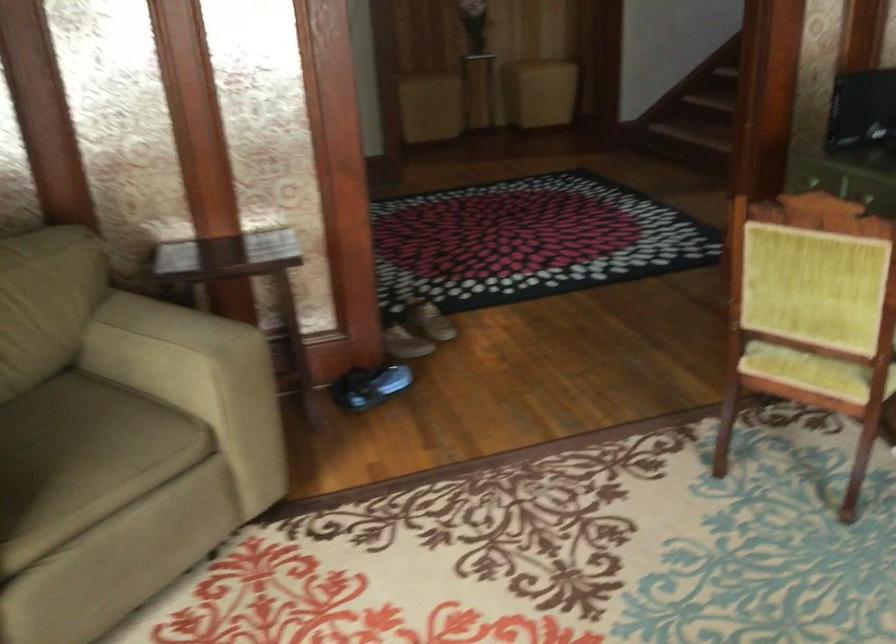
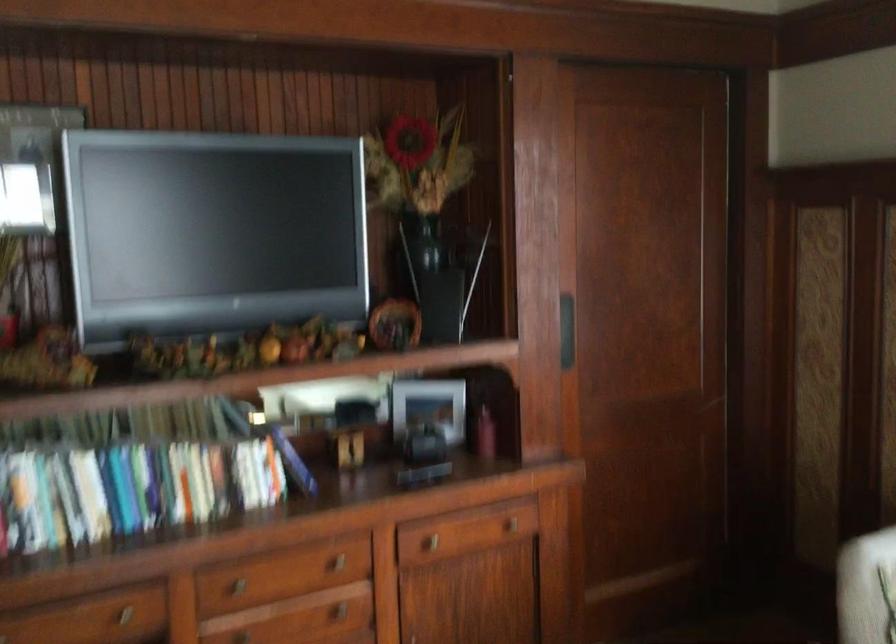
Question: The images are taken continuously from a first-person perspective. In which direction is your viewpoint rotating?

Choices:
 (A) Left
 (B) Right
 (C) Up
 (D) Down

Answer: (B)